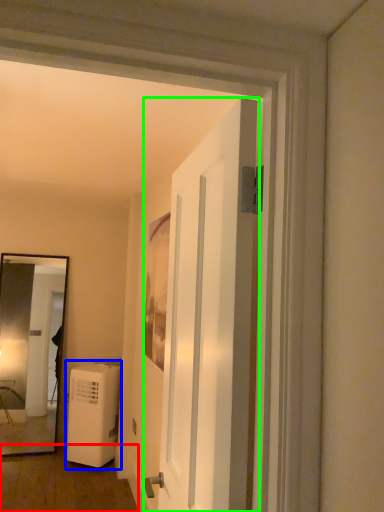
Question: Based on their relative distances, which object is farther from corridor (highlighted by a red box)? Choose from air conditioner (highlighted by a blue box) and door (highlighted by a green box).

Choices:
 (A) air conditioner
 (B) door

Answer: (B)